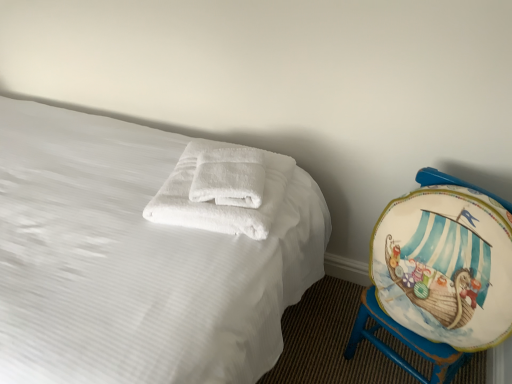
Find the location of a particular element. The image size is (512, 384). free spot above white fluffy towels at center (from a real-world perspective) is located at coordinates (223, 196).